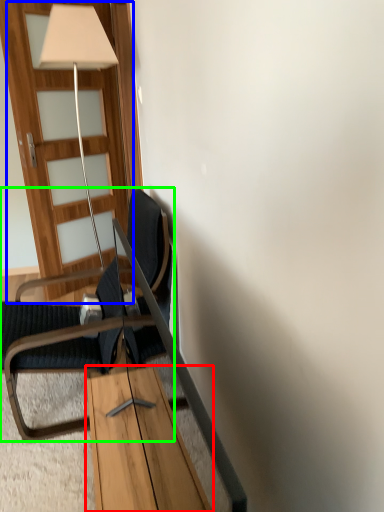
Question: Which is nearer to the table (highlighted by a red box)? door (highlighted by a blue box) or chair (highlighted by a green box).

Choices:
 (A) door
 (B) chair

Answer: (B)